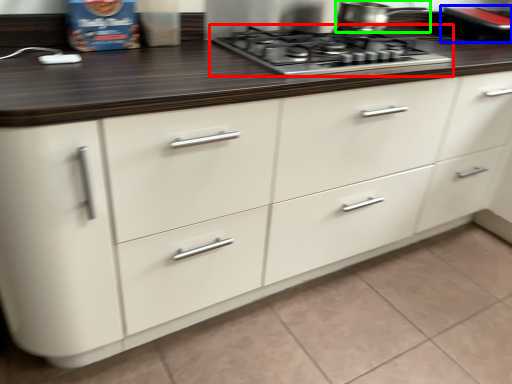
Question: Based on their relative distances, which object is nearer to gas stove (highlighted by a red box)? Choose from appliance (highlighted by a blue box) and kitchen appliance (highlighted by a green box).

Choices:
 (A) appliance
 (B) kitchen appliance

Answer: (B)